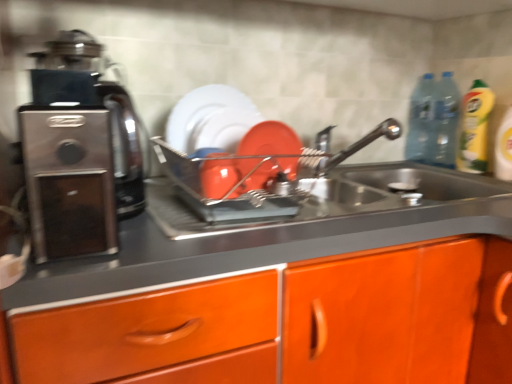
Question: Could you tell me if transparent plastic bottle at upper right, which is counted as the second bottle, starting from the left, is turned towards transparent plastic bottle at upper right, which ranks as the first bottle in left-to-right order?

Choices:
 (A) yes
 (B) no

Answer: (B)

Question: Is transparent plastic bottle at upper right, which ranks as the first bottle in left-to-right order, surrounded by transparent plastic bottle at upper right, which is counted as the second bottle, starting from the left?

Choices:
 (A) yes
 (B) no

Answer: (A)

Question: From a real-world perspective, does transparent plastic bottle at upper right, which is the first bottle in right-to-left order, sit lower than transparent plastic bottle at upper right, which ranks as the first bottle in left-to-right order?

Choices:
 (A) no
 (B) yes

Answer: (B)

Question: From a real-world perspective, is transparent plastic bottle at upper right, which is counted as the second bottle, starting from the left, on top of transparent plastic bottle at upper right, which ranks as the first bottle in left-to-right order?

Choices:
 (A) yes
 (B) no

Answer: (B)

Question: Does transparent plastic bottle at upper right, which is the first bottle in right-to-left order, have a lesser height compared to transparent plastic bottle at upper right, which is the 2th bottle in right-to-left order?

Choices:
 (A) no
 (B) yes

Answer: (A)

Question: In terms of height, does satin metallic sink at center look taller or shorter compared to satin nickel faucet at upper center?

Choices:
 (A) short
 (B) tall

Answer: (A)

Question: Considering the positions of satin metallic sink at center and satin nickel faucet at upper center in the image, is satin metallic sink at center bigger or smaller than satin nickel faucet at upper center?

Choices:
 (A) big
 (B) small

Answer: (A)

Question: Considering the positions of satin metallic sink at center and satin nickel faucet at upper center in the image, is satin metallic sink at center wider or thinner than satin nickel faucet at upper center?

Choices:
 (A) thin
 (B) wide

Answer: (B)

Question: Considering the relative positions of satin metallic sink at center and satin nickel faucet at upper center in the image provided, is satin metallic sink at center to the left or to the right of satin nickel faucet at upper center?

Choices:
 (A) left
 (B) right

Answer: (A)

Question: From the image's perspective, relative to yellow liquid bottle at right, is matte orange plate at center above or below?

Choices:
 (A) below
 (B) above

Answer: (A)

Question: Considering the positions of matte orange plate at center and yellow liquid bottle at right in the image, is matte orange plate at center wider or thinner than yellow liquid bottle at right?

Choices:
 (A) thin
 (B) wide

Answer: (A)

Question: From a real-world perspective, relative to yellow liquid bottle at right, is matte orange plate at center vertically above or below?

Choices:
 (A) below
 (B) above

Answer: (A)

Question: Relative to yellow liquid bottle at right, is matte orange plate at center in front or behind?

Choices:
 (A) behind
 (B) front

Answer: (B)

Question: Considering the positions of matte orange plate at center and transparent plastic bottle at upper right, which ranks as the first bottle in left-to-right order, in the image, is matte orange plate at center bigger or smaller than transparent plastic bottle at upper right, which ranks as the first bottle in left-to-right order,?

Choices:
 (A) big
 (B) small

Answer: (B)

Question: Based on their positions, is matte orange plate at center located to the left or right of transparent plastic bottle at upper right, which ranks as the first bottle in left-to-right order?

Choices:
 (A) right
 (B) left

Answer: (B)